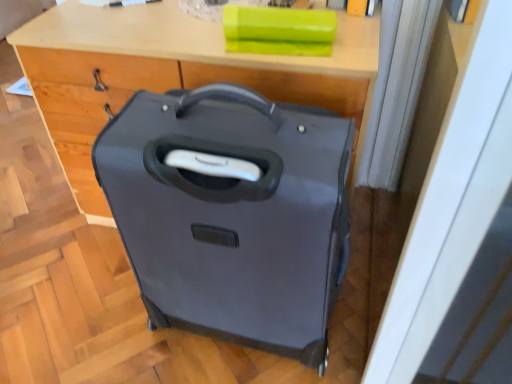
Question: Could you tell me if matte black suitcase at center is turned towards matte wood computer desk at center?

Choices:
 (A) no
 (B) yes

Answer: (A)

Question: Would you say matte black suitcase at center is outside matte wood computer desk at center?

Choices:
 (A) no
 (B) yes

Answer: (B)

Question: From a real-world perspective, is matte black suitcase at center positioned over matte wood computer desk at center based on gravity?

Choices:
 (A) no
 (B) yes

Answer: (B)

Question: Is matte black suitcase at center thinner than matte wood computer desk at center?

Choices:
 (A) no
 (B) yes

Answer: (B)

Question: Does matte black suitcase at center have a smaller size compared to matte wood computer desk at center?

Choices:
 (A) yes
 (B) no

Answer: (A)

Question: Can you confirm if matte black suitcase at center is positioned to the right of matte wood computer desk at center?

Choices:
 (A) yes
 (B) no

Answer: (A)

Question: From the image's perspective, does matte wood computer desk at center appear higher than matte black suitcase at center?

Choices:
 (A) yes
 (B) no

Answer: (A)

Question: Is matte wood computer desk at center taller than matte black suitcase at center?

Choices:
 (A) no
 (B) yes

Answer: (A)

Question: Can you confirm if matte wood computer desk at center is positioned to the left of matte black suitcase at center?

Choices:
 (A) yes
 (B) no

Answer: (A)

Question: Does matte wood computer desk at center have a greater width compared to matte black suitcase at center?

Choices:
 (A) yes
 (B) no

Answer: (A)

Question: Is matte wood computer desk at center positioned beyond the bounds of matte black suitcase at center?

Choices:
 (A) no
 (B) yes

Answer: (B)

Question: Does matte wood computer desk at center touch matte black suitcase at center?

Choices:
 (A) yes
 (B) no

Answer: (B)

Question: Is point (210, 87) positioned closer to the camera than point (358, 155)?

Choices:
 (A) farther
 (B) closer

Answer: (B)